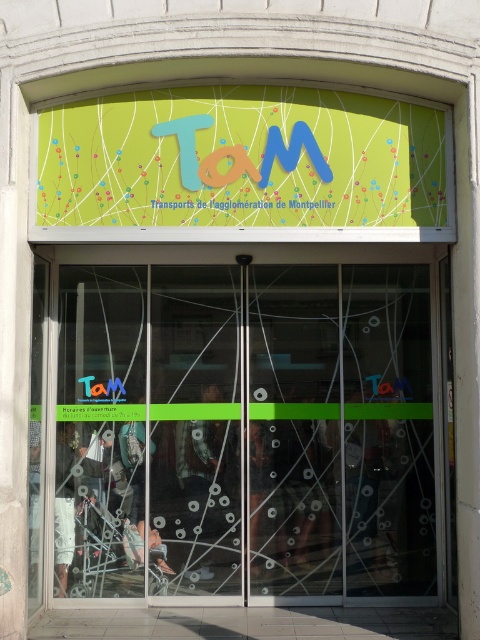
Question: Among these points, which one is farthest from the camera?

Choices:
 (A) (200, 88)
 (B) (239, 476)

Answer: (B)

Question: Which object is closer to the camera taking this photo?

Choices:
 (A) transparent glass doors at center
 (B) matte green signboard at upper center

Answer: (B)

Question: Is transparent glass doors at center positioned in front of matte green signboard at upper center?

Choices:
 (A) yes
 (B) no

Answer: (B)

Question: Can you confirm if transparent glass doors at center is wider than matte green signboard at upper center?

Choices:
 (A) yes
 (B) no

Answer: (A)

Question: Which object is farther from the camera taking this photo?

Choices:
 (A) matte green signboard at upper center
 (B) transparent glass doors at center

Answer: (B)

Question: Is transparent glass doors at center positioned in front of matte green signboard at upper center?

Choices:
 (A) yes
 (B) no

Answer: (B)